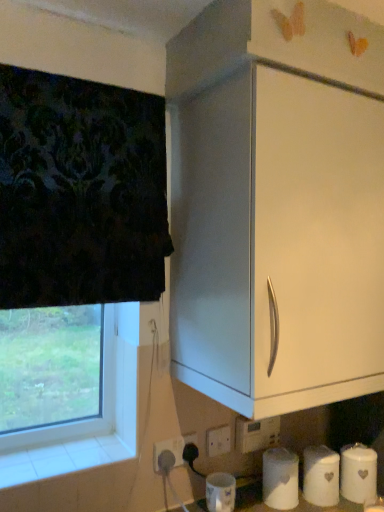
Question: Is transparent glass window at lower left turned away from white plastic electric outlet at lower center, the 3th electric outlet when ordered from right to left?

Choices:
 (A) no
 (B) yes

Answer: (A)

Question: Is the surface of transparent glass window at lower left in direct contact with white plastic electric outlet at lower center, placed as the 1th electric outlet when sorted from left to right?

Choices:
 (A) no
 (B) yes

Answer: (A)

Question: Could white plastic electric outlet at lower center, the 3th electric outlet when ordered from right to left, be considered to be inside transparent glass window at lower left?

Choices:
 (A) yes
 (B) no

Answer: (B)

Question: Does transparent glass window at lower left have a lesser width compared to white plastic electric outlet at lower center, the 3th electric outlet when ordered from right to left?

Choices:
 (A) no
 (B) yes

Answer: (A)

Question: Considering the relative positions of transparent glass window at lower left and white plastic electric outlet at lower center, the 3th electric outlet when ordered from right to left, in the image provided, is transparent glass window at lower left in front of white plastic electric outlet at lower center, the 3th electric outlet when ordered from right to left,?

Choices:
 (A) yes
 (B) no

Answer: (A)

Question: Considering the positions of white matte toilet paper at lower center, placed as the third toilet paper when sorted from right to left, and white ceramic canister at lower right, acting as the 1th toilet paper starting from the right, in the image, is white matte toilet paper at lower center, placed as the third toilet paper when sorted from right to left, taller or shorter than white ceramic canister at lower right, acting as the 1th toilet paper starting from the right,?

Choices:
 (A) short
 (B) tall

Answer: (B)

Question: From the image's perspective, is white matte toilet paper at lower center, the 1th toilet paper viewed from the left, located above or below white ceramic canister at lower right, which is the third toilet paper from left to right?

Choices:
 (A) below
 (B) above

Answer: (B)

Question: From a real-world perspective, is white matte toilet paper at lower center, the 1th toilet paper viewed from the left, above or below white ceramic canister at lower right, acting as the 1th toilet paper starting from the right?

Choices:
 (A) below
 (B) above

Answer: (B)

Question: Is white matte toilet paper at lower center, placed as the third toilet paper when sorted from right to left, wider or thinner than white ceramic canister at lower right, which is the third toilet paper from left to right?

Choices:
 (A) thin
 (B) wide

Answer: (B)

Question: In terms of width, does white plastic electric outlet at lower center, the third electric outlet positioned from the left, look wider or thinner when compared to white ceramic canister at lower right, which is the third toilet paper from left to right?

Choices:
 (A) wide
 (B) thin

Answer: (B)

Question: From the image's perspective, relative to white ceramic canister at lower right, acting as the 1th toilet paper starting from the right, is white plastic electric outlet at lower center, the third electric outlet positioned from the left, above or below?

Choices:
 (A) above
 (B) below

Answer: (A)

Question: In terms of size, does white plastic electric outlet at lower center, arranged as the 1th electric outlet when viewed from the right, appear bigger or smaller than white ceramic canister at lower right, acting as the 1th toilet paper starting from the right?

Choices:
 (A) big
 (B) small

Answer: (B)

Question: Choose the correct answer: Is white plastic electric outlet at lower center, the third electric outlet positioned from the left, inside white ceramic canister at lower right, acting as the 1th toilet paper starting from the right, or outside it?

Choices:
 (A) outside
 (B) inside

Answer: (A)

Question: Choose the correct answer: Is white plastic electric outlet at lower center, placed as the 1th electric outlet when sorted from left to right, inside white plastic electric outlet at lower center, the third electric outlet positioned from the left, or outside it?

Choices:
 (A) inside
 (B) outside

Answer: (B)

Question: Considering their positions, is white plastic electric outlet at lower center, the 3th electric outlet when ordered from right to left, located in front of or behind white plastic electric outlet at lower center, the third electric outlet positioned from the left?

Choices:
 (A) front
 (B) behind

Answer: (A)